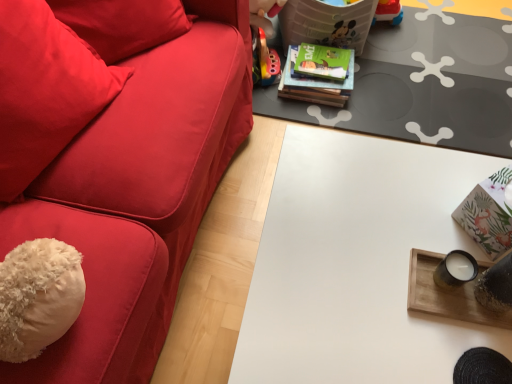
This screenshot has height=384, width=512. I want to click on empty space that is ontop of green matte book at upper center (from a real-world perspective), so click(x=328, y=57).